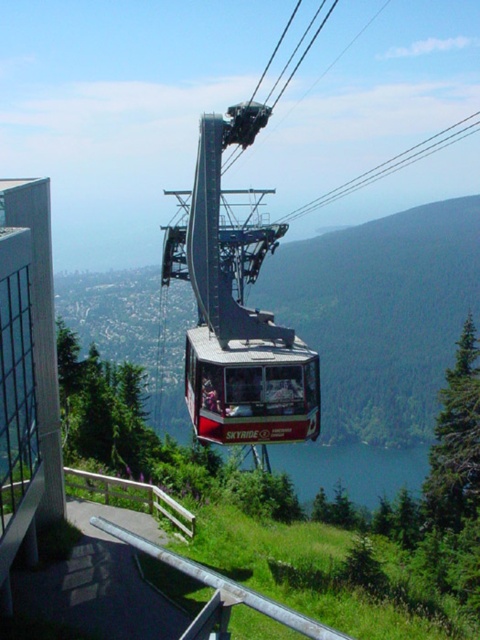
You are a passenger in the red matte cable car at center. Looking down, you see the blue water at lower center. Can you determine if the cable car is currently above the water?

The red matte cable car at center is positioned over blue water at lower center, so yes, the cable car is currently above the water.

You are a tourist planning to take a photo of the red matte cable car at center and the blue water at lower center through the window of the SKYRIDE. Considering the size of the objects, which one will appear smaller in your photo?

The red matte cable car at center will appear smaller in your photo because it has a lesser width compared to the blue water at lower center.